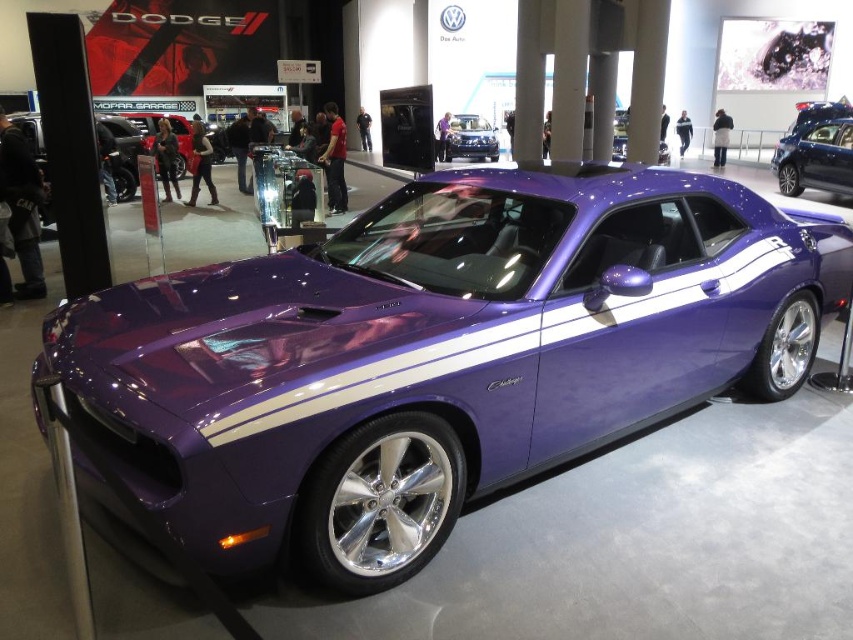
Which is below, shiny purple car at center or purple glossy dodge challenger at center?

shiny purple car at center

Is shiny purple car at center shorter than purple glossy dodge challenger at center?

Incorrect, shiny purple car at center's height does not fall short of purple glossy dodge challenger at center's.

In order to click on shiny purple car at center in this screenshot , I will do `click(436, 355)`.

I want to click on shiny purple car at center, so click(436, 355).

Who is positioned more to the right, shiny purple car at center or glossy purple car at center?

From the viewer's perspective, glossy purple car at center appears more on the right side.

Does shiny purple car at center appear on the right side of glossy purple car at center?

In fact, shiny purple car at center is to the left of glossy purple car at center.

Is point (637, 365) closer to camera compared to point (845, 134)?

Yes, it is in front of point (845, 134).

At what (x,y) coordinates should I click in order to perform the action: click on shiny purple car at center. Please return your answer as a coordinate pair (x, y). Looking at the image, I should click on point(436,355).

Does glossy purple car at center come in front of purple glossy dodge challenger at center?

That is True.

Can you confirm if glossy purple car at center is positioned below purple glossy dodge challenger at center?

Indeed, glossy purple car at center is positioned under purple glossy dodge challenger at center.

This screenshot has height=640, width=853. In order to click on glossy purple car at center in this screenshot , I will do `click(815, 157)`.

Locate an element on the screen. This screenshot has height=640, width=853. glossy purple car at center is located at coordinates (815, 157).